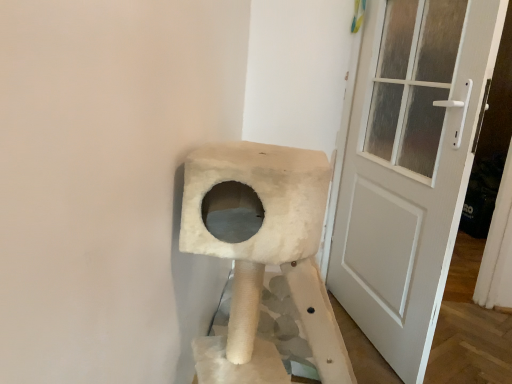
Question: Is white textured door at right wider than white fluffy cat furniture at center?

Choices:
 (A) no
 (B) yes

Answer: (A)

Question: Is white textured door at right aimed at white fluffy cat furniture at center?

Choices:
 (A) yes
 (B) no

Answer: (B)

Question: Can you confirm if white textured door at right is bigger than white fluffy cat furniture at center?

Choices:
 (A) yes
 (B) no

Answer: (B)

Question: From a real-world perspective, is white textured door at right located higher than white fluffy cat furniture at center?

Choices:
 (A) no
 (B) yes

Answer: (B)

Question: Is white textured door at right positioned with its back to white fluffy cat furniture at center?

Choices:
 (A) yes
 (B) no

Answer: (A)

Question: Are white textured door at right and white fluffy cat furniture at center located far from each other?

Choices:
 (A) yes
 (B) no

Answer: (B)

Question: Does white fluffy cat furniture at center have a smaller size compared to white textured door at right?

Choices:
 (A) no
 (B) yes

Answer: (A)

Question: Is white fluffy cat furniture at center bigger than white textured door at right?

Choices:
 (A) no
 (B) yes

Answer: (B)

Question: Is white fluffy cat furniture at center to the right of white textured door at right from the viewer's perspective?

Choices:
 (A) no
 (B) yes

Answer: (A)

Question: Can you confirm if white fluffy cat furniture at center is thinner than white textured door at right?

Choices:
 (A) no
 (B) yes

Answer: (A)

Question: From a real-world perspective, is white fluffy cat furniture at center positioned under white textured door at right based on gravity?

Choices:
 (A) yes
 (B) no

Answer: (A)

Question: From the image's perspective, would you say white fluffy cat furniture at center is shown under white textured door at right?

Choices:
 (A) yes
 (B) no

Answer: (A)

Question: In the image, is white fluffy cat furniture at center positioned in front of or behind white textured door at right?

Choices:
 (A) front
 (B) behind

Answer: (A)